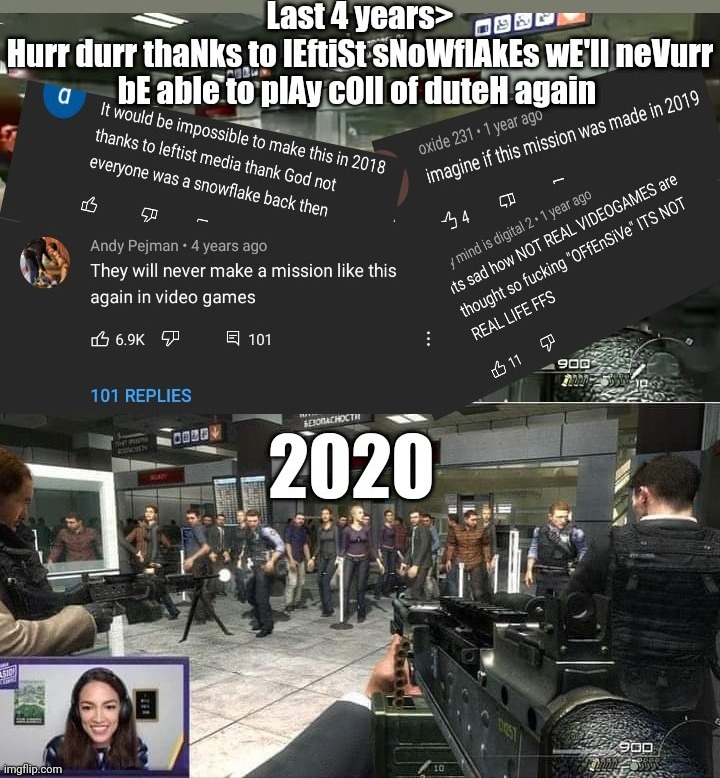
Find the location of a particular element. The height and width of the screenshot is (778, 720). white wall in background in streamers room is located at coordinates (60, 705).